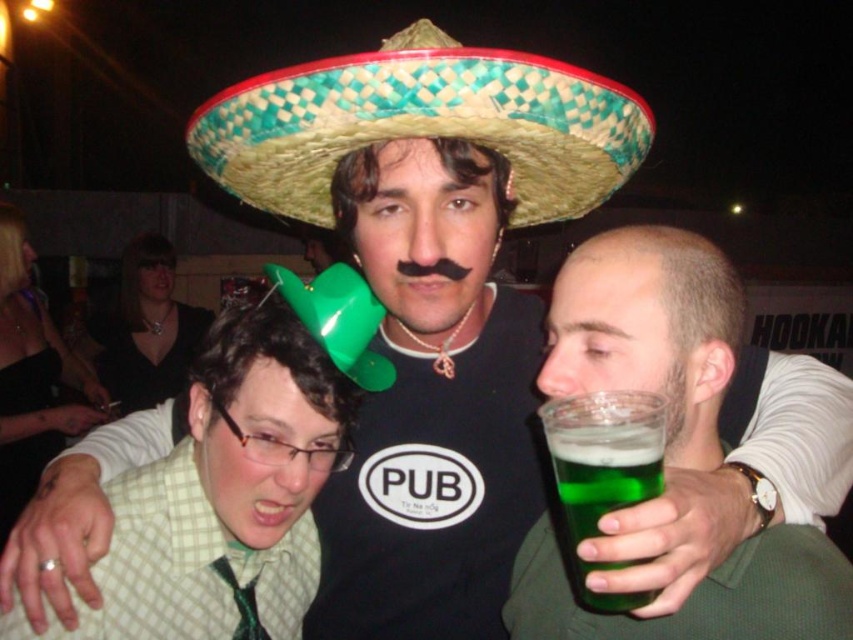
Can you confirm if woven straw sombrero at center is shorter than green woven straw sombrero at center?

No.

Between woven straw sombrero at center and green woven straw sombrero at center, which one has less height?

Standing shorter between the two is green woven straw sombrero at center.

Describe the element at coordinates (422, 124) in the screenshot. This screenshot has width=853, height=640. I see `woven straw sombrero at center` at that location.

Identify the location of woven straw sombrero at center. (422, 124).

Is woven straw sombrero at center closer to the viewer compared to green glass at lower right?

No.

Does woven straw sombrero at center lie behind green glass at lower right?

Yes.

Which is in front, point (529, 164) or point (593, 486)?

Positioned in front is point (593, 486).

This screenshot has height=640, width=853. I want to click on woven straw sombrero at center, so click(x=422, y=124).

Who is positioned more to the left, green matte hat at center or green glass at lower right?

green matte hat at center is more to the left.

Is the position of green matte hat at center more distant than that of green glass at lower right?

Yes, it is.

Locate an element on the screen. The height and width of the screenshot is (640, 853). green matte hat at center is located at coordinates (271, 410).

Where is `green matte hat at center`? Image resolution: width=853 pixels, height=640 pixels. green matte hat at center is located at coordinates (271, 410).